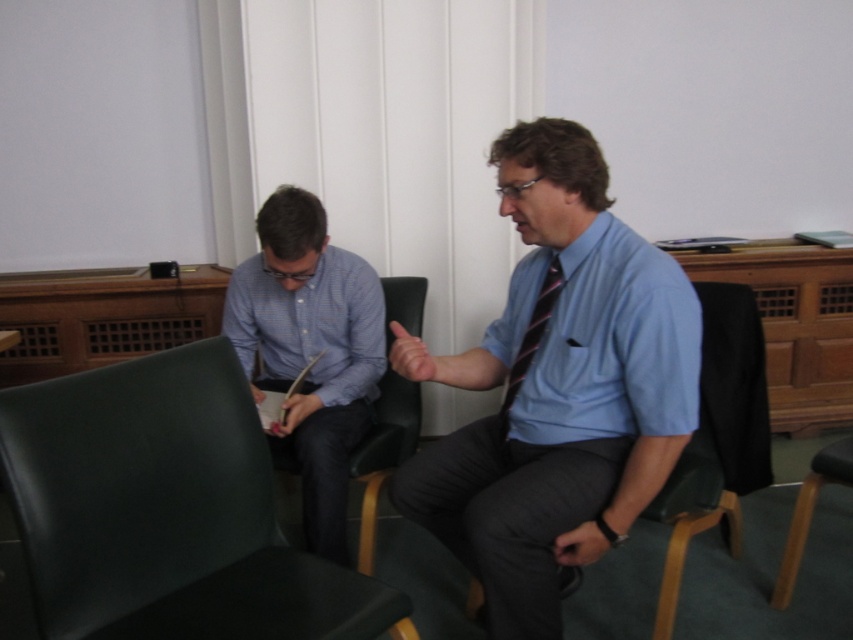
You are an observer in the room. You notice the blue shirt at center and the striped fabric tie at center. Which object is positioned lower in the image?

The blue shirt at center is located below striped fabric tie at center, so the blue shirt at center is positioned lower in the image.

You are designing a layout for a new office space and need to place a 1.5 meter wide desk between the blue striped shirt at left and the black leather chair at center. Based on their widths, will the desk fit between them without overlapping?

The blue striped shirt at left is wider than the black leather chair at center. Since the desk is 1.5 meters wide, but the total combined width of both objects is not provided, it is impossible to determine if the desk will fit without overlapping. More information about the exact widths of both objects is needed to make an accurate assessment.